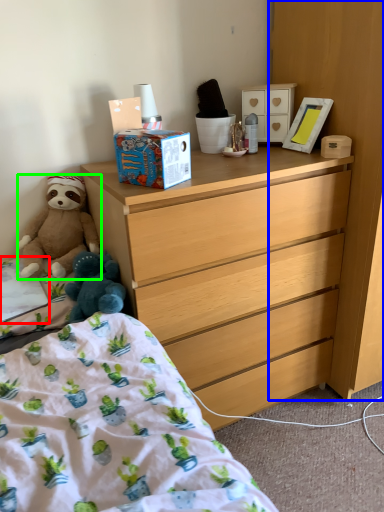
Question: Estimate the real-world distances between objects in this image. Which object is farther from sheet (highlighted by a red box), cabinetry (highlighted by a blue box) or teddy bear (highlighted by a green box)?

Choices:
 (A) cabinetry
 (B) teddy bear

Answer: (A)